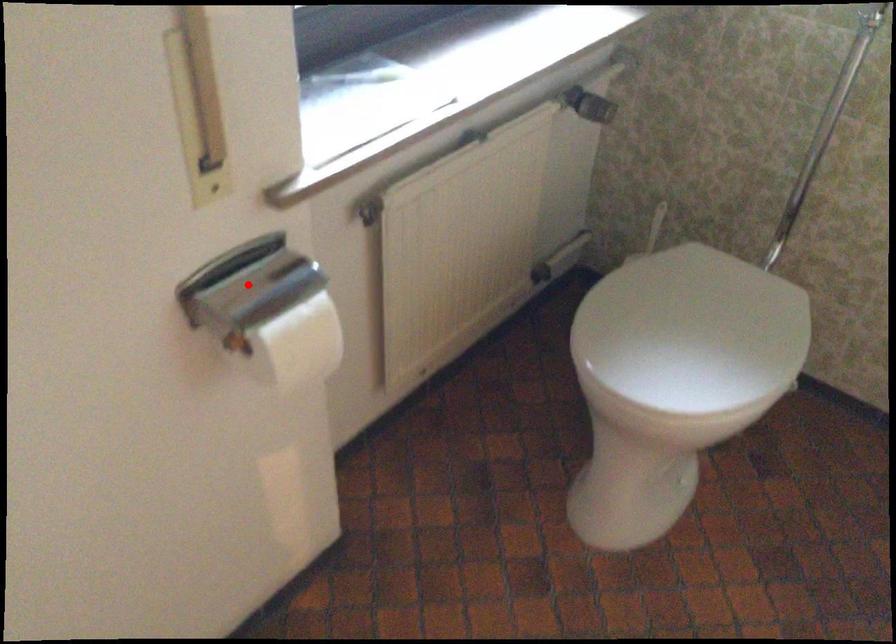
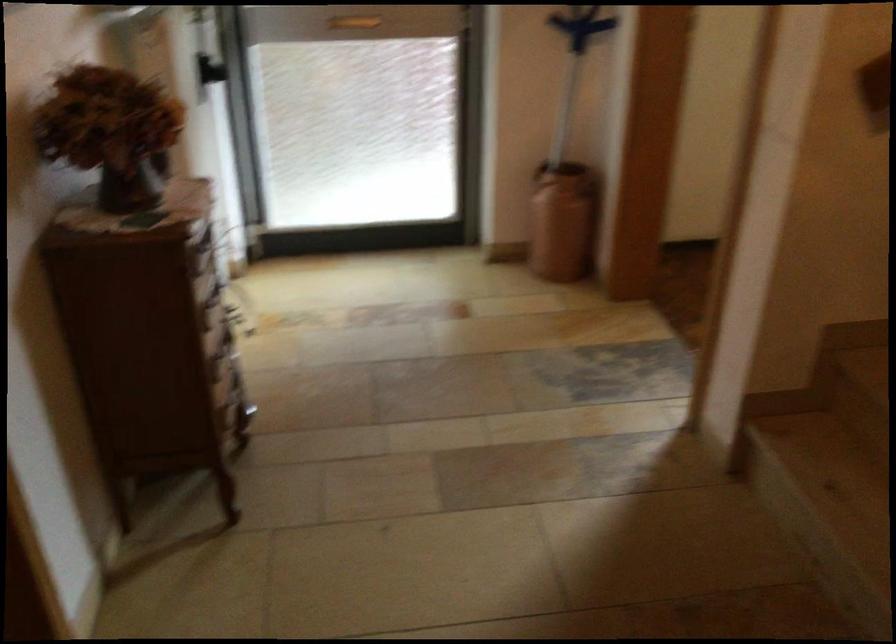
Question: I am providing you with two images of the same scene from different viewpoints. A red point is marked on the first image. Can you still see the location of the red point in image 2?

Choices:
 (A) Yes
 (B) No

Answer: (B)